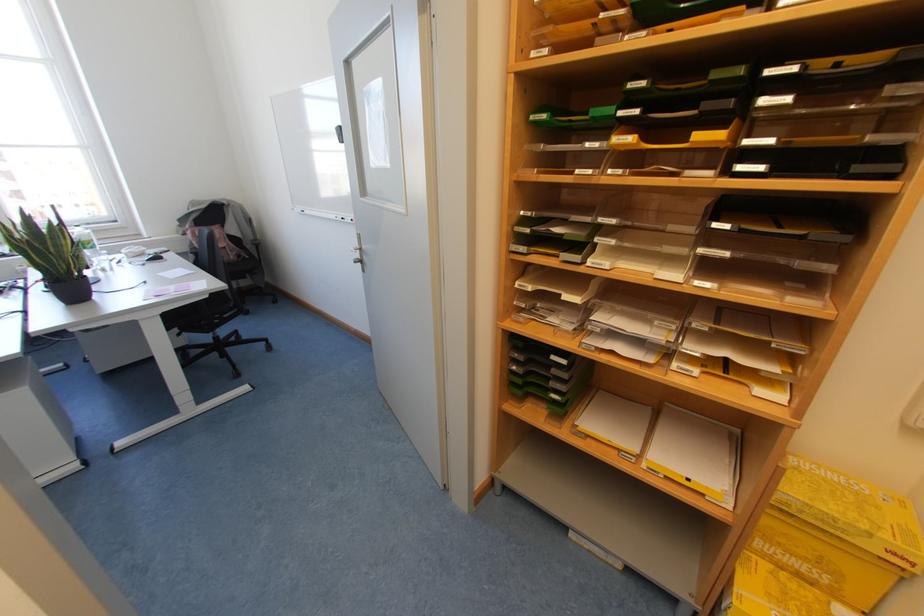
The location [652,221] corresponds to which object?

It refers to a clear paper tray.